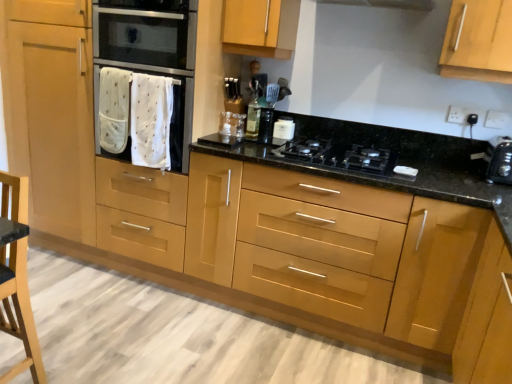
Question: From a real-world perspective, is white glossy container at upper center positioned over black plastic toaster at right based on gravity?

Choices:
 (A) yes
 (B) no

Answer: (B)

Question: From the image's perspective, does white glossy container at upper center appear lower than black plastic toaster at right?

Choices:
 (A) no
 (B) yes

Answer: (A)

Question: Does white glossy container at upper center come behind black plastic toaster at right?

Choices:
 (A) yes
 (B) no

Answer: (A)

Question: Is white glossy container at upper center thinner than black plastic toaster at right?

Choices:
 (A) yes
 (B) no

Answer: (A)

Question: Is white glossy container at upper center next to black plastic toaster at right?

Choices:
 (A) yes
 (B) no

Answer: (B)

Question: Do you think wooden armchair at lower left is within black plastic toaster at right, or outside of it?

Choices:
 (A) inside
 (B) outside

Answer: (B)

Question: Considering the positions of wooden armchair at lower left and black plastic toaster at right in the image, is wooden armchair at lower left wider or thinner than black plastic toaster at right?

Choices:
 (A) thin
 (B) wide

Answer: (A)

Question: In terms of height, does wooden armchair at lower left look taller or shorter compared to black plastic toaster at right?

Choices:
 (A) short
 (B) tall

Answer: (B)

Question: From the image's perspective, relative to black plastic toaster at right, is wooden armchair at lower left above or below?

Choices:
 (A) above
 (B) below

Answer: (B)

Question: Is black plastic toaster at right inside the boundaries of wooden armchair at lower left, or outside?

Choices:
 (A) outside
 (B) inside

Answer: (A)

Question: In terms of height, does black plastic toaster at right look taller or shorter compared to wooden armchair at lower left?

Choices:
 (A) tall
 (B) short

Answer: (B)

Question: Is black plastic toaster at right in front of or behind wooden armchair at lower left in the image?

Choices:
 (A) front
 (B) behind

Answer: (B)

Question: From the image's perspective, is black plastic toaster at right located above or below wooden armchair at lower left?

Choices:
 (A) above
 (B) below

Answer: (A)

Question: In terms of width, does wooden armchair at lower left look wider or thinner when compared to white fabric oven at left?

Choices:
 (A) thin
 (B) wide

Answer: (A)

Question: Is wooden armchair at lower left to the left or to the right of white fabric oven at left in the image?

Choices:
 (A) right
 (B) left

Answer: (B)